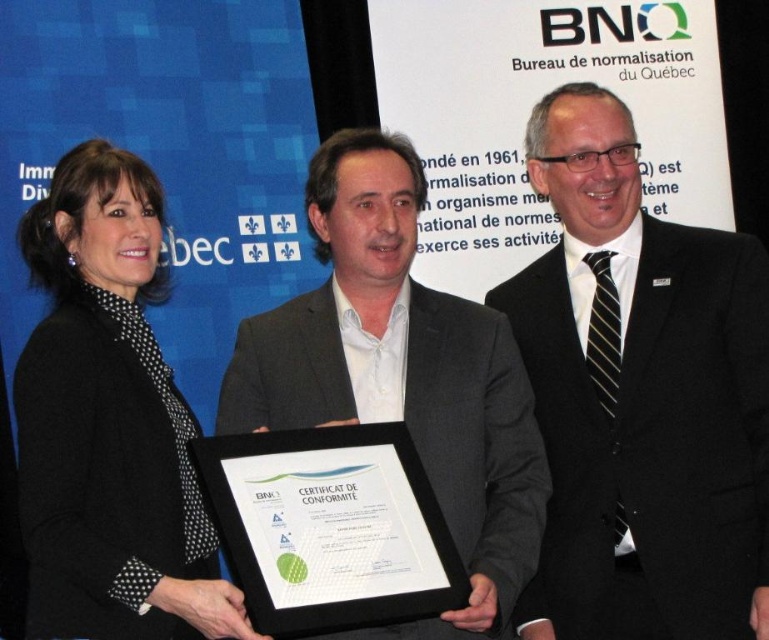
Based on the photo, can you confirm if black suit at center is positioned to the left of matte gray suit at center?

In fact, black suit at center is to the right of matte gray suit at center.

Can you confirm if black suit at center is thinner than matte gray suit at center?

Correct, black suit at center's width is less than matte gray suit at center's.

Between point (606, 115) and point (335, 326), which one is positioned in front?

Point (335, 326)

What are the coordinates of `black suit at center` in the screenshot? It's located at (641, 397).

Consider the image. Is black suit at center smaller than black dotted blazer at left?

Yes.

Who is shorter, black suit at center or black dotted blazer at left?

With less height is black dotted blazer at left.

Is point (718, 484) farther from camera compared to point (227, 592)?

Yes, it is.

This screenshot has height=640, width=769. What are the coordinates of `black suit at center` in the screenshot? It's located at (641, 397).

Can you confirm if black dotted blazer at left is positioned to the right of matte gray suit at center?

In fact, black dotted blazer at left is to the left of matte gray suit at center.

Is black dotted blazer at left in front of matte gray suit at center?

Yes, black dotted blazer at left is closer to the viewer.

Find the location of a particular element. The image size is (769, 640). black dotted blazer at left is located at coordinates (108, 422).